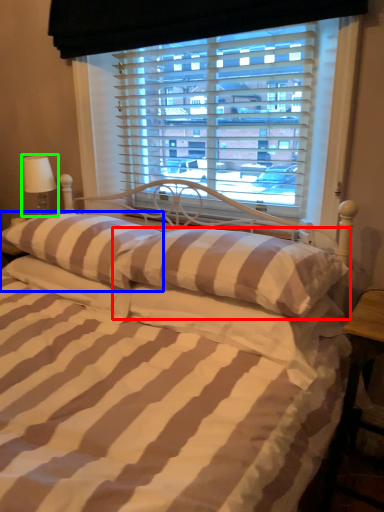
Question: Estimate the real-world distances between objects in this image. Which object is closer to pillow (highlighted by a red box), pillow (highlighted by a blue box) or table lamp (highlighted by a green box)?

Choices:
 (A) pillow
 (B) table lamp

Answer: (A)